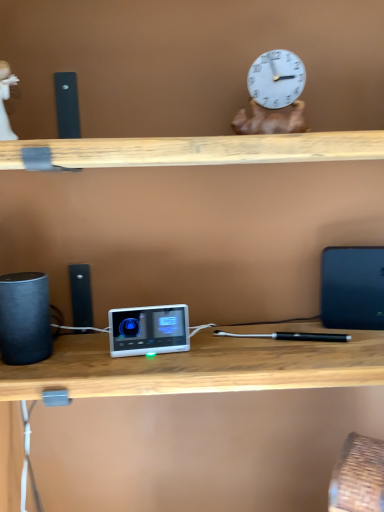
Question: From the image's perspective, is blue matte laptop at right below white porcelain figurine at upper left?

Choices:
 (A) yes
 (B) no

Answer: (A)

Question: Is blue matte laptop at right placed right next to white porcelain figurine at upper left?

Choices:
 (A) yes
 (B) no

Answer: (B)

Question: Is blue matte laptop at right further to camera compared to white porcelain figurine at upper left?

Choices:
 (A) yes
 (B) no

Answer: (A)

Question: Is blue matte laptop at right bigger than white porcelain figurine at upper left?

Choices:
 (A) yes
 (B) no

Answer: (A)

Question: From the image's perspective, would you say blue matte laptop at right is positioned over white porcelain figurine at upper left?

Choices:
 (A) no
 (B) yes

Answer: (A)

Question: Considering the positions of black matte speaker at left and blue matte laptop at right in the image, is black matte speaker at left bigger or smaller than blue matte laptop at right?

Choices:
 (A) big
 (B) small

Answer: (B)

Question: Do you think black matte speaker at left is within blue matte laptop at right, or outside of it?

Choices:
 (A) outside
 (B) inside

Answer: (A)

Question: From their relative heights in the image, would you say black matte speaker at left is taller or shorter than blue matte laptop at right?

Choices:
 (A) tall
 (B) short

Answer: (B)

Question: Considering the positions of point pos(36,276) and point pos(349,281), is point pos(36,276) closer or farther from the camera than point pos(349,281)?

Choices:
 (A) closer
 (B) farther

Answer: (A)

Question: Considering the positions of black matte speaker at left and white porcelain figurine at upper left in the image, is black matte speaker at left bigger or smaller than white porcelain figurine at upper left?

Choices:
 (A) big
 (B) small

Answer: (A)

Question: From a real-world perspective, is black matte speaker at left positioned above or below white porcelain figurine at upper left?

Choices:
 (A) below
 (B) above

Answer: (A)

Question: Is point (4, 312) positioned closer to the camera than point (11, 138)?

Choices:
 (A) closer
 (B) farther

Answer: (B)

Question: Considering the positions of black matte speaker at left and white porcelain figurine at upper left in the image, is black matte speaker at left wider or thinner than white porcelain figurine at upper left?

Choices:
 (A) wide
 (B) thin

Answer: (A)

Question: Looking at their shapes, would you say white porcelain figurine at upper left is wider or thinner than blue matte laptop at right?

Choices:
 (A) wide
 (B) thin

Answer: (A)

Question: Is point tap(1, 86) closer or farther from the camera than point tap(360, 304)?

Choices:
 (A) farther
 (B) closer

Answer: (B)